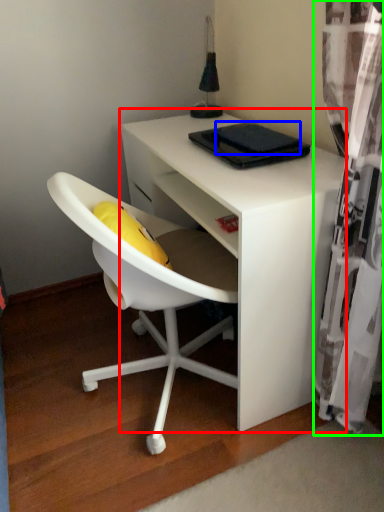
Question: Considering the real-world distances, which object is farthest from desk (highlighted by a red box)? pad (highlighted by a blue box) or curtain (highlighted by a green box)?

Choices:
 (A) pad
 (B) curtain

Answer: (A)